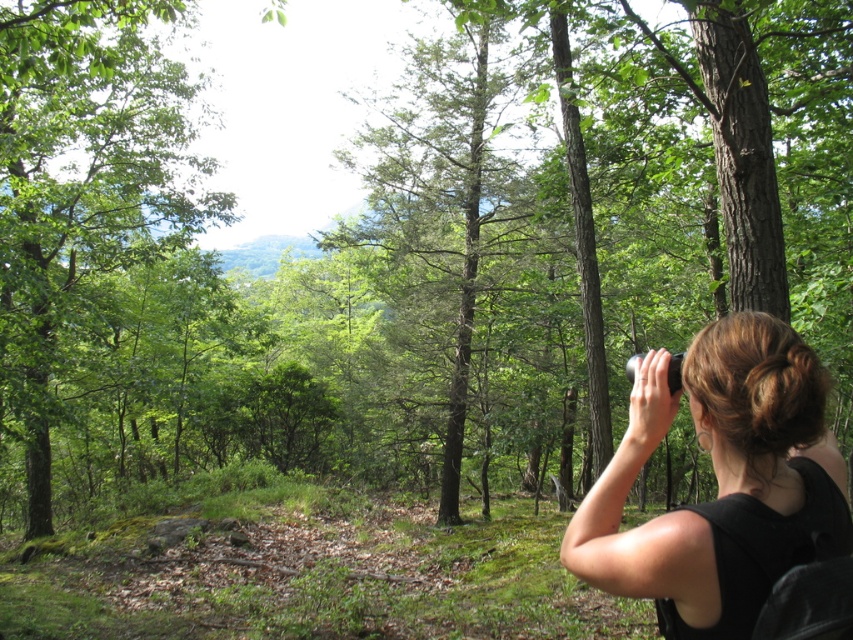
Question: Is black matte binoculars at center bigger than green matte tree at center?

Choices:
 (A) yes
 (B) no

Answer: (B)

Question: Does green leafy tree at left have a smaller size compared to green matte tree at center?

Choices:
 (A) no
 (B) yes

Answer: (A)

Question: Which point is farther to the camera?

Choices:
 (A) (476, 56)
 (B) (102, 1)

Answer: (A)

Question: Among these points, which one is farthest from the camera?

Choices:
 (A) (792, 456)
 (B) (51, 221)

Answer: (B)

Question: Based on their relative distances, which object is nearer to the black matte binoculars at center?

Choices:
 (A) green leafy tree at left
 (B) green matte tree at center

Answer: (B)

Question: Does black matte binoculars at center have a lesser width compared to green matte tree at center?

Choices:
 (A) no
 (B) yes

Answer: (B)